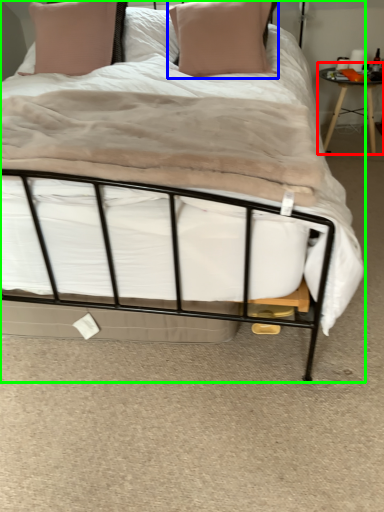
Question: Based on their relative distances, which object is nearer to table (highlighted by a red box)? Choose from pillow (highlighted by a blue box) and bed (highlighted by a green box).

Choices:
 (A) pillow
 (B) bed

Answer: (A)